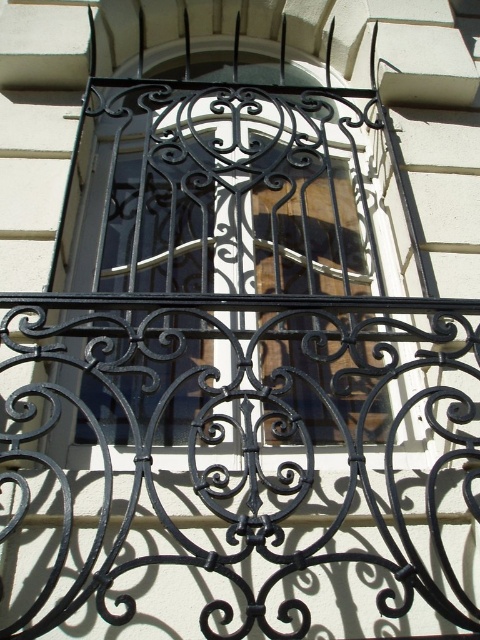
Is black wrought iron balcony at center thinner than black wrought iron at center?

No.

Is black wrought iron balcony at center taller than black wrought iron at center?

No.

Image resolution: width=480 pixels, height=640 pixels. What do you see at coordinates (231, 452) in the screenshot?
I see `black wrought iron balcony at center` at bounding box center [231, 452].

I want to click on black wrought iron balcony at center, so click(231, 452).